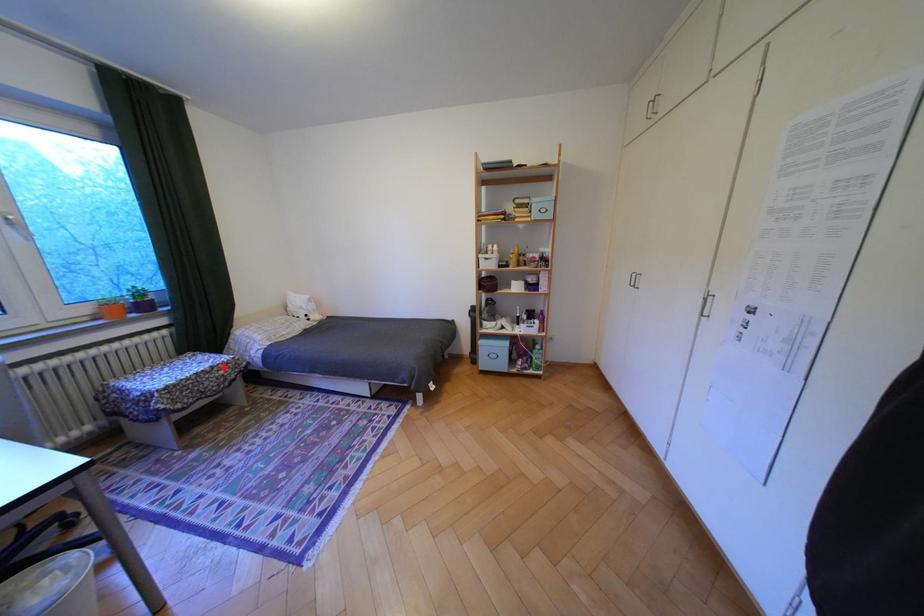
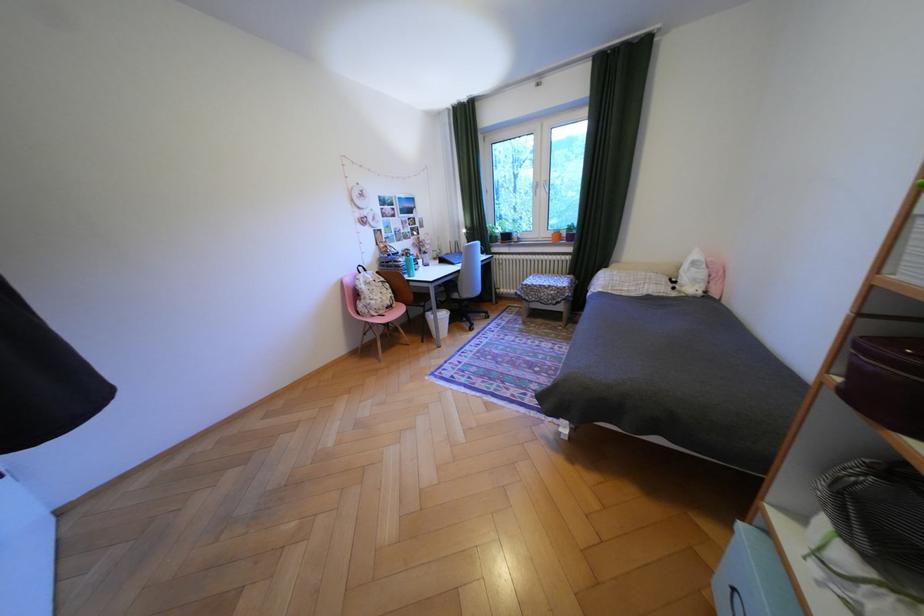
Question: A red point is marked in image1. In image2, is the corresponding 3D point closer to the camera or farther? Reply with the corresponding letter.

Choices:
 (A) The corresponding 3D point is closer.
 (B) The corresponding 3D point is farther.

Answer: (B)